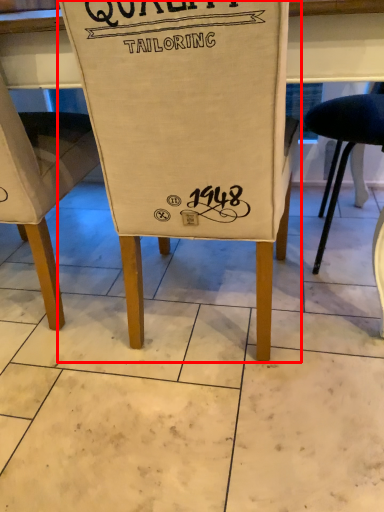
Question: Considering the relative positions of chair (annotated by the red box) and chair in the image provided, where is chair (annotated by the red box) located with respect to the staircase?

Choices:
 (A) left
 (B) right

Answer: (B)